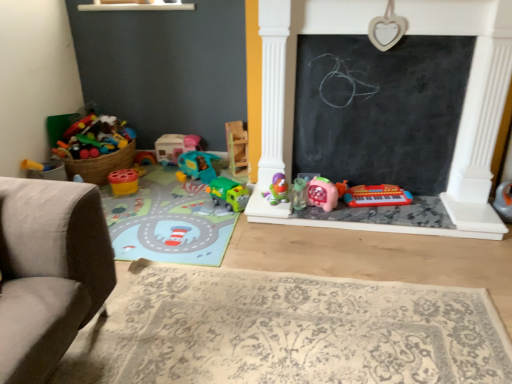
You are a GUI agent. You are given a task and a screenshot of the screen. Output one action in this format:
    pyautogui.click(x=<x>, y=<y>)
    Task: Click on the free space in front of green plastic truck at center, which ranks as the 4th toy in left-to-right order
    
    Given the screenshot: What is the action you would take?
    pyautogui.click(x=220, y=217)